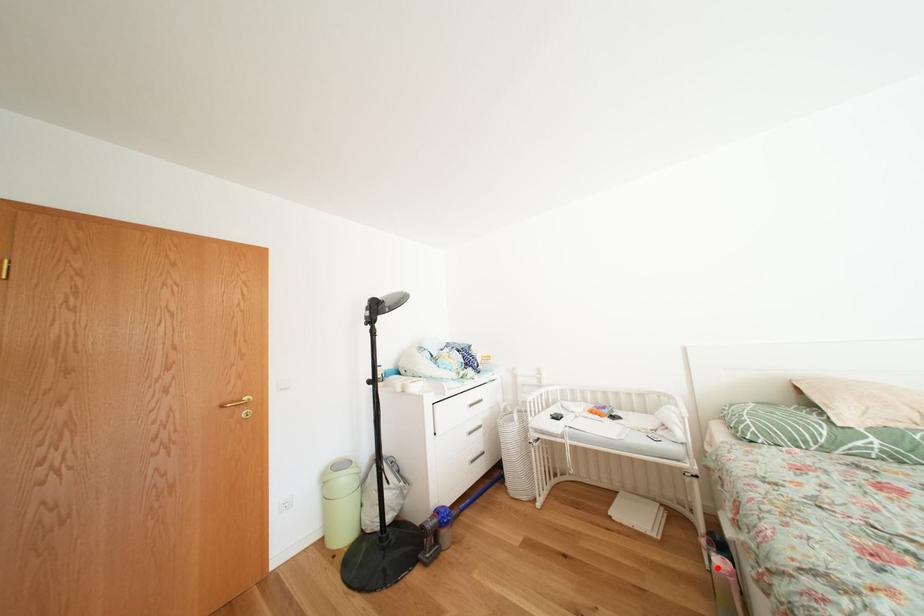
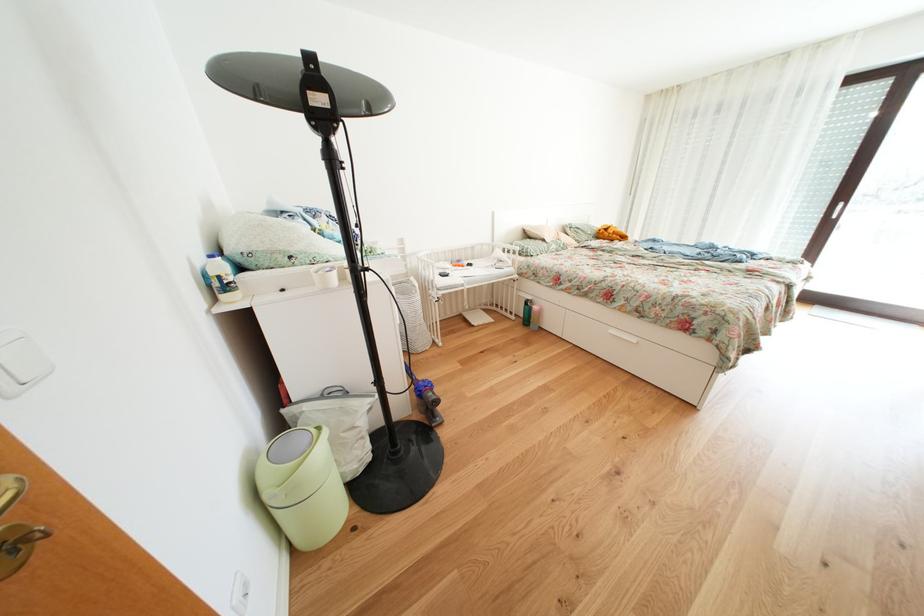
Question: I am providing you with two images of the same scene from different viewpoints. A red point is marked on the first image. Is the red point's position out of view in image 2?

Choices:
 (A) Yes
 (B) No

Answer: (B)